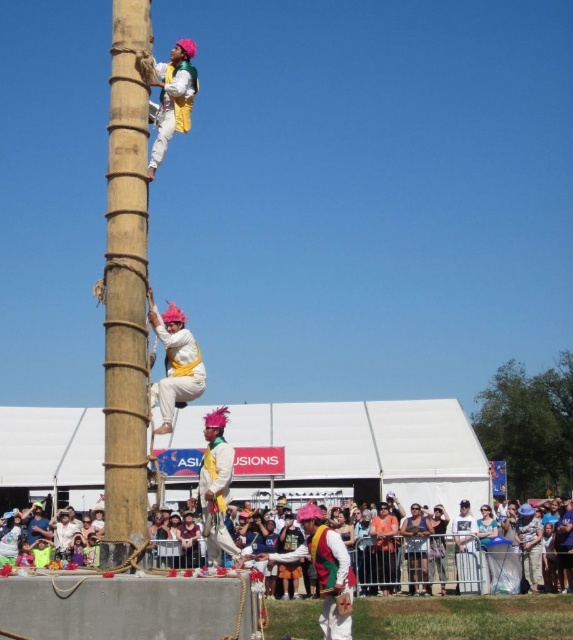
Is the position of natural wood pole at center more distant than that of matte white fabric at center?

No, natural wood pole at center is closer to the viewer.

Is natural wood pole at center taller than matte white fabric at center?

Yes.

Is point (140, 221) farther from viewer compared to point (174, 387)?

That is True.

Find the location of a particular element. Image resolution: width=573 pixels, height=640 pixels. natural wood pole at center is located at coordinates (125, 285).

Between multicolored fabric crowd at lower center and matte yellow fabric at upper center, which one is positioned higher?

matte yellow fabric at upper center

Does point (378, 540) come closer to viewer compared to point (174, 97)?

No, (378, 540) is further to viewer.

Who is more forward, (425,540) or (190,49)?

Positioned in front is point (190,49).

Identify the location of multicolored fabric crowd at lower center. The width and height of the screenshot is (573, 640). (460, 557).

Is natural wood pole at center behind matte yellow fabric at center?

No, natural wood pole at center is in front of matte yellow fabric at center.

Is point (131, 348) farther from viewer compared to point (221, 540)?

No.

Is point (143, 141) positioned behind point (219, 515)?

Yes, it is.

Locate an element on the screen. The width and height of the screenshot is (573, 640). natural wood pole at center is located at coordinates (125, 285).